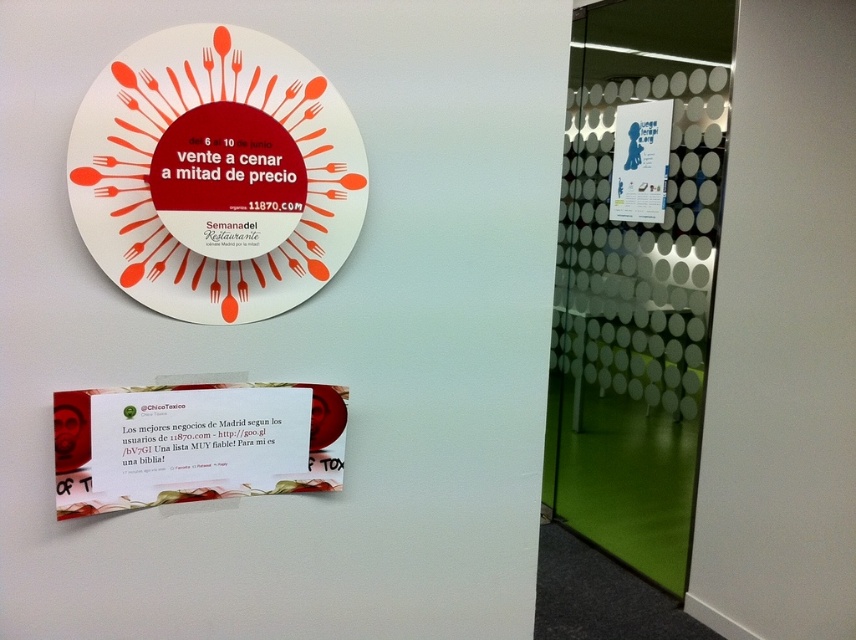
You are a delivery person who needs to place a new menu on the wall between the white paper plate at upper center and the white paper poster at upper right. The menu is 2 feet wide. Can you fit it between them without overlapping either object?

The distance between the white paper plate at upper center and the white paper poster at upper right is 7.12 feet. Since the menu is only 2 feet wide, there is sufficient space to place it between them without overlapping either object.

You are hanging decorations on a wall and have a white paper plate at upper center and a white paper poster at upper right. Which object is located below the other?

The white paper plate at upper center is positioned under the white paper poster at upper right.

You are organizing a picnic and have brought both the white paper plate at upper center and the white paper at center. Which item would you use for placing food, and why?

The white paper plate at upper center is taller than the white paper at center, so it would be more suitable for placing food as it can hold items upright or provide a raised surface.